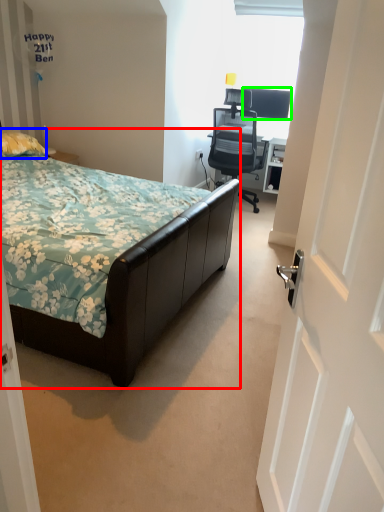
Question: Which object is positioned closest to bed (highlighted by a red box)? Select from pillow (highlighted by a blue box) and television (highlighted by a green box).

Choices:
 (A) pillow
 (B) television

Answer: (A)